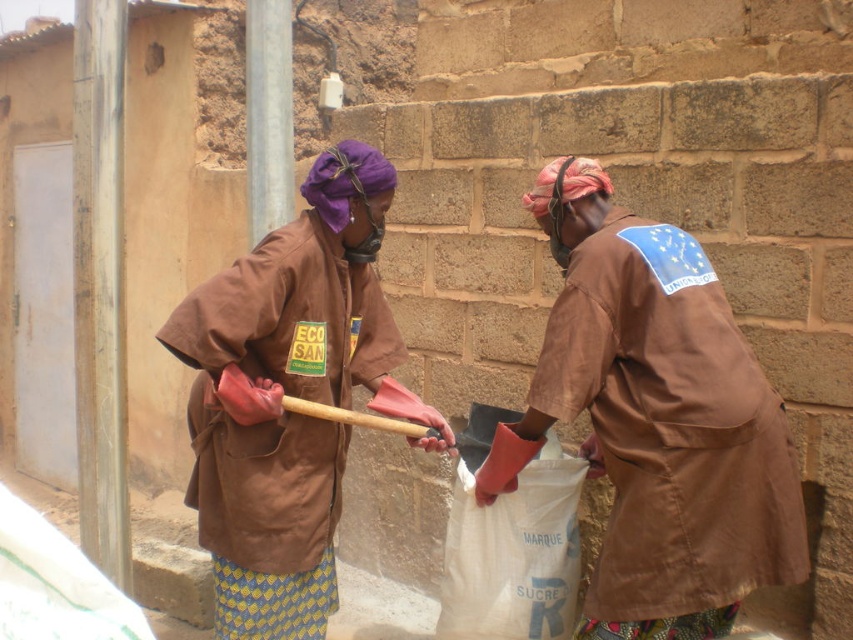
You are a construction supervisor checking the site layout. There is a point marked at coordinates [657,420] in the image. What object does this point correspond to?

The point at coordinates [657,420] corresponds to the brown fabric uniform at center.

You are a supervisor checking the work area. You see the brown fabric uniform at center and the brown fabric robe at right. Which one is closer to you?

The brown fabric uniform at center is closer to you than the brown fabric robe at right.